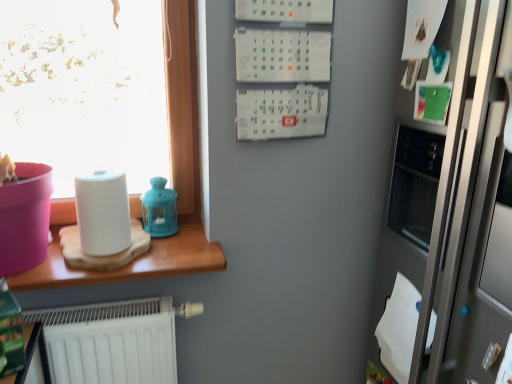
Question: Visually, is white matte paper towel at left positioned to the left or to the right of satin silver fridge at right?

Choices:
 (A) left
 (B) right

Answer: (A)

Question: From a real-world perspective, is white matte paper towel at left above or below satin silver fridge at right?

Choices:
 (A) above
 (B) below

Answer: (A)

Question: Based on their relative distances, which object is nearer to the matte blue lantern at upper center?

Choices:
 (A) wooden table at left
 (B) satin silver fridge at right
 (C) white matte paper towel at left

Answer: (A)

Question: Which is farther from the satin silver fridge at right?

Choices:
 (A) wooden table at left
 (B) matte blue lantern at upper center
 (C) white matte paper towel at left

Answer: (C)